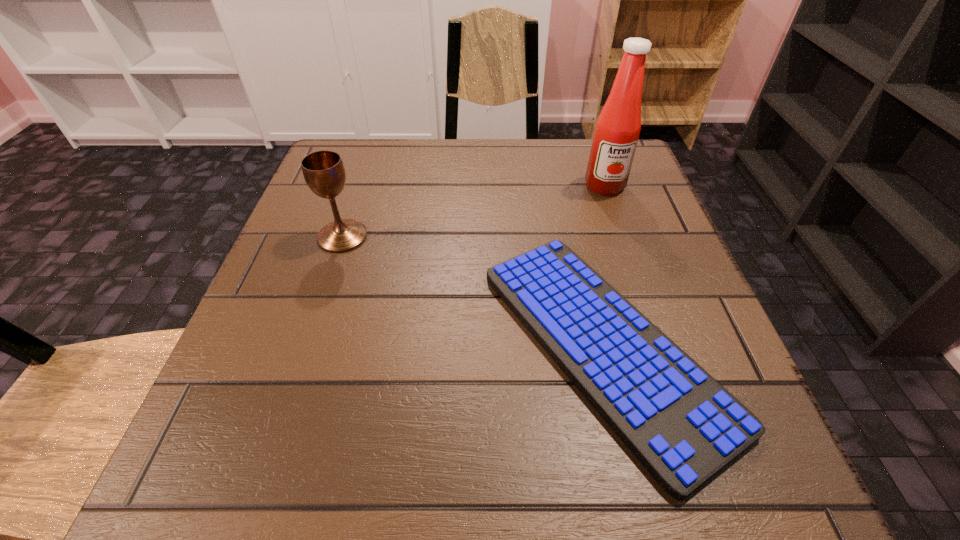
I want to click on object located at the left edge, so click(324, 172).

Locate an element on the screen. This screenshot has height=540, width=960. condiment present at the right edge is located at coordinates (617, 130).

Identify the location of computer keyboard at the right edge. The image size is (960, 540). (683, 426).

Locate an element on the screen. object present at the far right corner is located at coordinates (617, 130).

Where is `object located at the near right corner`? This screenshot has height=540, width=960. object located at the near right corner is located at coordinates (x=683, y=426).

Where is `vacant space at the far edge of the desktop`? This screenshot has height=540, width=960. vacant space at the far edge of the desktop is located at coordinates (455, 145).

This screenshot has width=960, height=540. Find the location of `free spot at the near edge of the desktop`. free spot at the near edge of the desktop is located at coordinates (523, 486).

Locate an element on the screen. The width and height of the screenshot is (960, 540). free space at the left edge of the desktop is located at coordinates (286, 347).

The height and width of the screenshot is (540, 960). Find the location of `vacant region at the right edge of the desktop`. vacant region at the right edge of the desktop is located at coordinates (705, 320).

Where is `vacant space at the far left corner of the desktop`? vacant space at the far left corner of the desktop is located at coordinates (337, 143).